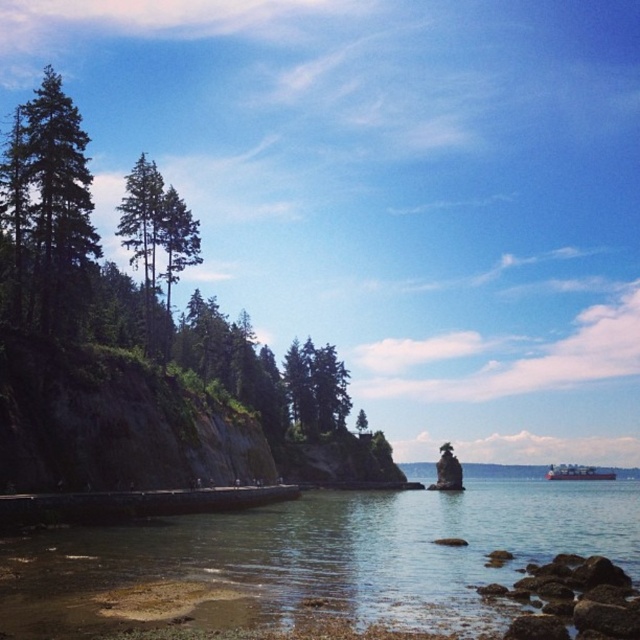
You are standing at the shoreline looking towards the cliff. Which object is closer to your left side, the green matte tree at left or the brown rough rocks at lower right?

The green matte tree at left is positioned on the left side of brown rough rocks at lower right, so the green matte tree at left is closer to your left side.

You are a photographer planning to capture the brown rough rocks at lower right and the white matte cargo ship at lower right in the same frame. Given that the camera lens you have can only focus on objects within a 5 meter width, can both objects fit within the frame?

The brown rough rocks at lower right are narrower than the white matte cargo ship at lower right. Since the total width required to include both would depend on their combined size and spacing, but the description only states the rocks are narrower than the ship. Without exact measurements of their separation or the ship and rocks individual widths, it is impossible to definitively answer if they fit within the 5 meter width constraint. However, if the rocks are significantly smaller and positioned closely,

You are standing at the camera position observing the coastal scene. There is a small, solitary rock located at point (58, 285). If you want to throw a pebble to hit this rock, considering the distance, is it feasible for an average adult to do so?

The distance between the camera and the rock at point (58, 285) is 82.77 meters. An average adult cannot throw a pebble that far, so it is not feasible.